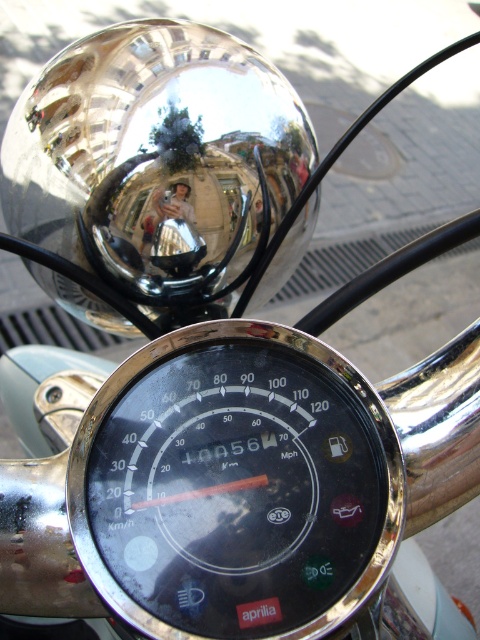
Question: Does black glass speedometer at center appear on the left side of polished chrome mirror at upper center?

Choices:
 (A) yes
 (B) no

Answer: (B)

Question: Where is black glass speedometer at center located in relation to polished chrome mirror at upper center in the image?

Choices:
 (A) below
 (B) above

Answer: (A)

Question: Which object is farther from the camera taking this photo?

Choices:
 (A) polished chrome mirror at upper center
 (B) black glass speedometer at center

Answer: (A)

Question: Is black glass speedometer at center smaller than polished chrome mirror at upper center?

Choices:
 (A) no
 (B) yes

Answer: (B)

Question: Which point is farther to the camera?

Choices:
 (A) (152, 477)
 (B) (2, 164)

Answer: (B)

Question: Which of the following is the closest to the observer?

Choices:
 (A) (88, 512)
 (B) (240, 54)

Answer: (A)